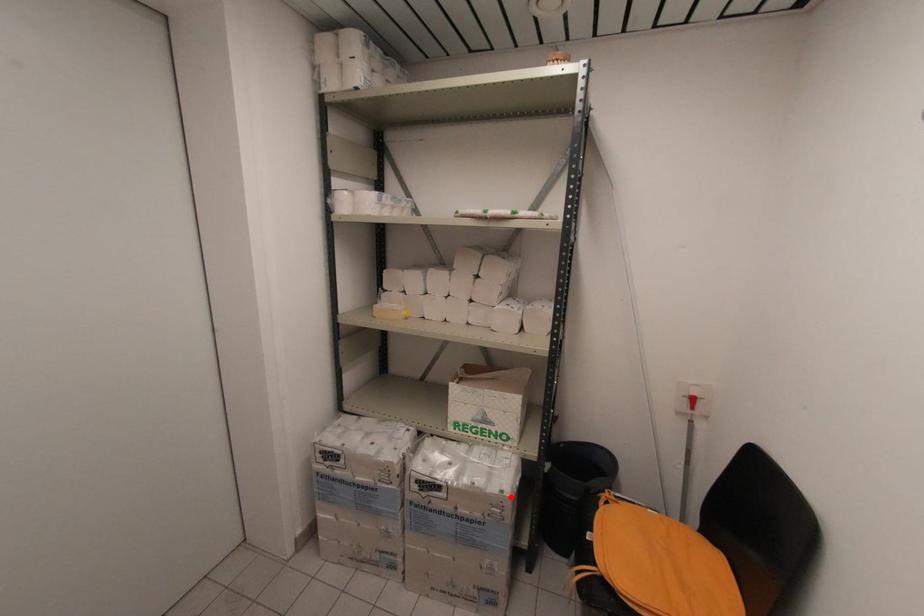
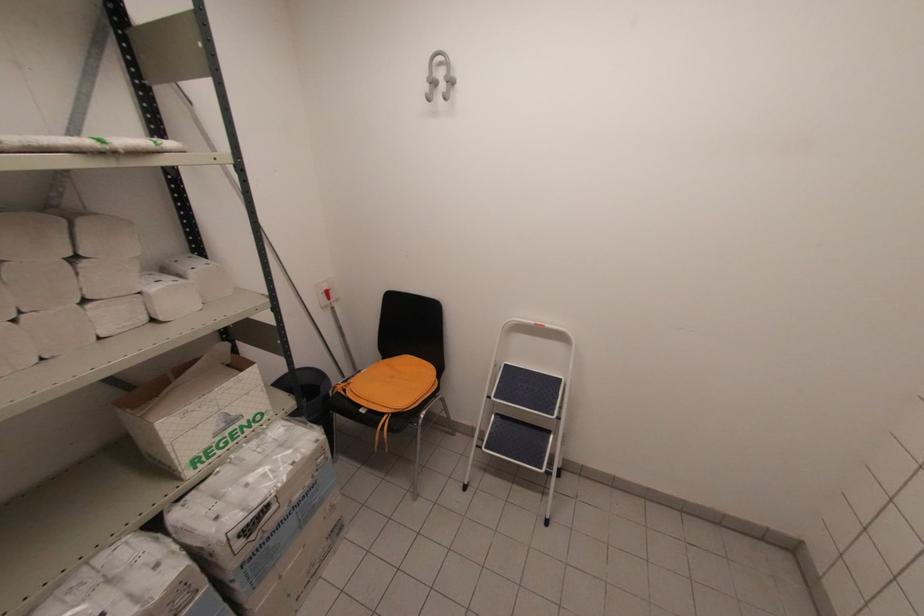
Question: I am providing you with two images of the same scene from different viewpoints. In image1, a red point is highlighted. Considering the same 3D point in image2, which of the following is correct?

Choices:
 (A) It is closer
 (B) It is farther

Answer: (A)